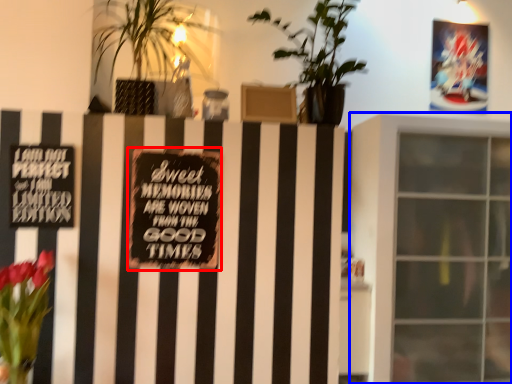
Question: Which point is further to the camera, plaque (highlighted by a red box) or window (highlighted by a blue box)?

Choices:
 (A) plaque
 (B) window

Answer: (B)